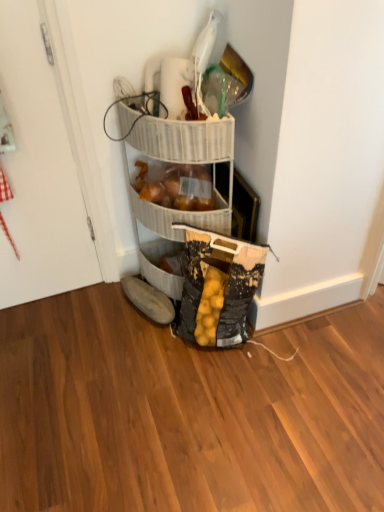
Question: Is white glossy door at left bigger than translucent plastic bag of onions at center?

Choices:
 (A) yes
 (B) no

Answer: (A)

Question: Is white glossy door at left completely or partially outside of translucent plastic bag of onions at center?

Choices:
 (A) no
 (B) yes

Answer: (B)

Question: Does white glossy door at left have a greater width compared to translucent plastic bag of onions at center?

Choices:
 (A) yes
 (B) no

Answer: (B)

Question: From a real-world perspective, is white glossy door at left physically above translucent plastic bag of onions at center?

Choices:
 (A) yes
 (B) no

Answer: (A)

Question: Considering the relative positions of white glossy door at left and translucent plastic bag of onions at center in the image provided, is white glossy door at left in front of translucent plastic bag of onions at center?

Choices:
 (A) no
 (B) yes

Answer: (B)

Question: Based on their sizes in the image, would you say translucent plastic bag of onions at center is bigger or smaller than brown suede shoe at lower center?

Choices:
 (A) big
 (B) small

Answer: (A)

Question: From their relative heights in the image, would you say translucent plastic bag of onions at center is taller or shorter than brown suede shoe at lower center?

Choices:
 (A) short
 (B) tall

Answer: (B)

Question: Considering the relative positions of translucent plastic bag of onions at center and brown suede shoe at lower center in the image provided, is translucent plastic bag of onions at center to the left or to the right of brown suede shoe at lower center?

Choices:
 (A) left
 (B) right

Answer: (B)

Question: From the image's perspective, is translucent plastic bag of onions at center located above or below brown suede shoe at lower center?

Choices:
 (A) below
 (B) above

Answer: (B)

Question: From a real-world perspective, relative to translucent plastic bag of onions at center, is white glossy door at left vertically above or below?

Choices:
 (A) below
 (B) above

Answer: (B)

Question: Considering the positions of white glossy door at left and translucent plastic bag of onions at center in the image, is white glossy door at left wider or thinner than translucent plastic bag of onions at center?

Choices:
 (A) thin
 (B) wide

Answer: (A)

Question: Is white glossy door at left in front of or behind translucent plastic bag of onions at center in the image?

Choices:
 (A) front
 (B) behind

Answer: (A)

Question: From the image's perspective, is white glossy door at left above or below translucent plastic bag of onions at center?

Choices:
 (A) above
 (B) below

Answer: (B)

Question: From the image's perspective, relative to brown suede shoe at lower center, is white glossy door at left above or below?

Choices:
 (A) above
 (B) below

Answer: (A)

Question: Is white glossy door at left spatially inside brown suede shoe at lower center, or outside of it?

Choices:
 (A) inside
 (B) outside

Answer: (B)